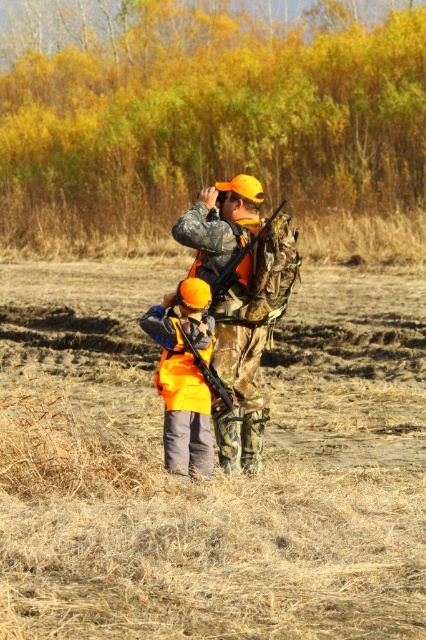
Is brown dry grass at center smaller than matte black shotgun at center?

Incorrect, brown dry grass at center is not smaller in size than matte black shotgun at center.

Between brown dry grass at center and matte black shotgun at center, which one appears on the left side from the viewer's perspective?

brown dry grass at center is more to the left.

Identify the location of brown dry grass at center. (216, 472).

Who is taller, matte orange shotgun at center or matte black shotgun at center?

Standing taller between the two is matte black shotgun at center.

Can you confirm if matte orange shotgun at center is positioned to the right of matte black shotgun at center?

No, matte orange shotgun at center is not to the right of matte black shotgun at center.

Who is more distant from viewer, [209,387] or [250,244]?

Point [250,244]

This screenshot has height=640, width=426. Find the location of `matte orange shotgun at center`. matte orange shotgun at center is located at coordinates (207, 372).

Which is more to the left, camouflage fabric rifle at center or matte orange shotgun at center?

matte orange shotgun at center is more to the left.

Does camouflage fabric rifle at center have a lesser height compared to matte orange shotgun at center?

Incorrect, camouflage fabric rifle at center's height does not fall short of matte orange shotgun at center's.

Does point (279, 308) lie behind point (224, 412)?

No, (279, 308) is closer to viewer.

Locate an element on the screen. The width and height of the screenshot is (426, 640). camouflage fabric rifle at center is located at coordinates (241, 301).